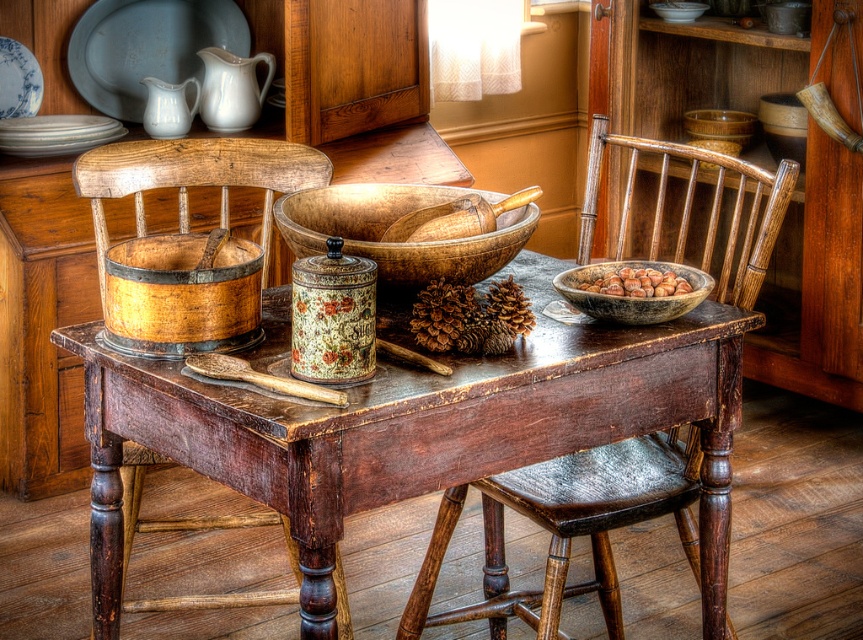
Between wooden table at center and wooden bowl filled with nuts at center, which one appears on the right side from the viewer's perspective?

wooden bowl filled with nuts at center is more to the right.

Can you confirm if wooden table at center is shorter than wooden bowl filled with nuts at center?

In fact, wooden table at center may be taller than wooden bowl filled with nuts at center.

This screenshot has height=640, width=863. What are the coordinates of `wooden table at center` in the screenshot? It's located at coord(417,435).

Does wooden bowl at center have a smaller size compared to matte white bowl at upper center?

Incorrect, wooden bowl at center is not smaller in size than matte white bowl at upper center.

Which is in front, point (471, 276) or point (671, 20)?

Point (471, 276) is more forward.

Who is more forward, (328, 209) or (694, 10)?

Point (328, 209) is more forward.

Identify the location of wooden bowl at center. This screenshot has width=863, height=640. (391, 221).

Does point (98, 148) lie behind point (202, 84)?

No.

Is point (255, 337) closer to viewer compared to point (243, 109)?

Yes, it is.

Find the location of a particular element. wooden chair at left is located at coordinates (194, 182).